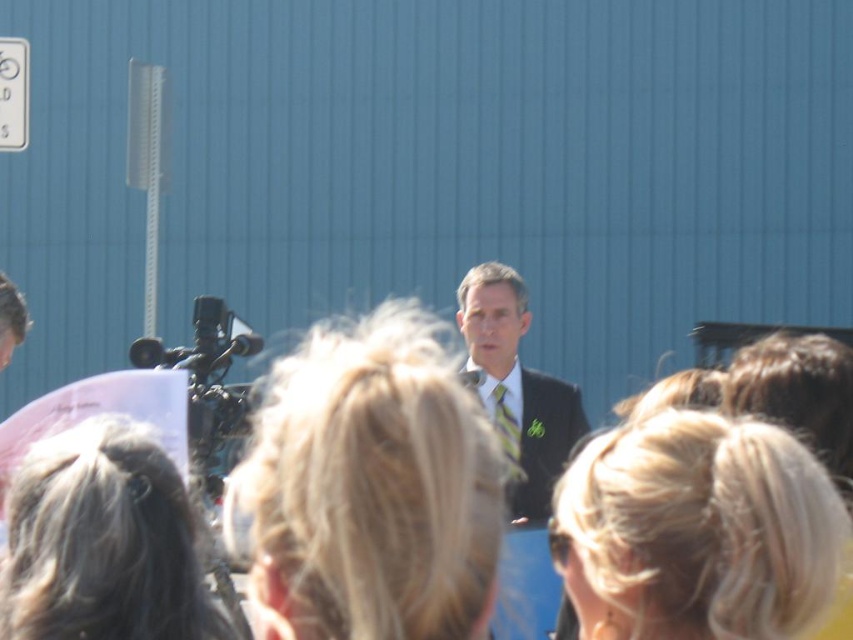
Question: From the image, what is the correct spatial relationship of metallic rectangular at upper left in relation to green striped tie at center?

Choices:
 (A) below
 (B) above

Answer: (B)

Question: Considering the real-world distances, which object is closest to the dark suit at center?

Choices:
 (A) green striped tie at center
 (B) metallic rectangular at upper left

Answer: (A)

Question: Which of the following is the farthest from the observer?

Choices:
 (A) (21, 128)
 (B) (497, 388)
 (C) (537, 460)

Answer: (A)

Question: Is metallic rectangular at upper left positioned before green striped tie at center?

Choices:
 (A) yes
 (B) no

Answer: (B)

Question: Which point is closer to the camera?

Choices:
 (A) (496, 388)
 (B) (509, 506)
 (C) (9, 113)

Answer: (B)

Question: Can you confirm if metallic rectangular at upper left is bigger than green striped tie at center?

Choices:
 (A) no
 (B) yes

Answer: (B)